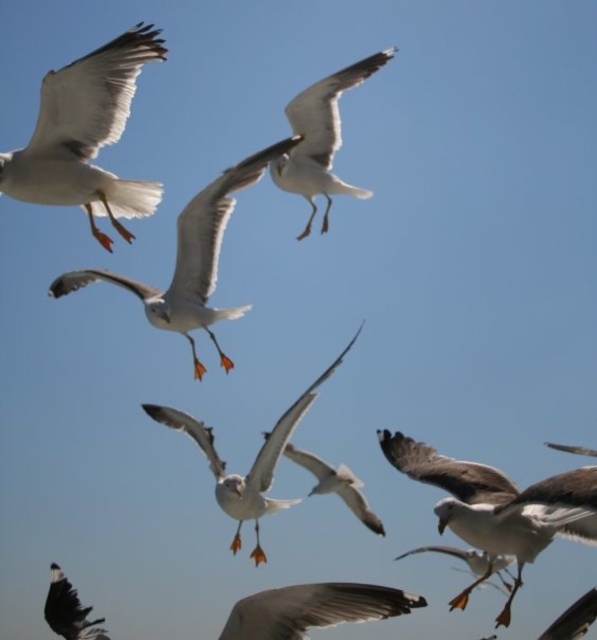
Question: Does white matte seagull at upper left have a smaller size compared to white feathered seagull at lower center?

Choices:
 (A) no
 (B) yes

Answer: (B)

Question: Does white feathered seagull at lower right have a larger size compared to white matte seagull at center?

Choices:
 (A) yes
 (B) no

Answer: (B)

Question: Which point is closer to the camera?

Choices:
 (A) (227, 632)
 (B) (214, 276)
 (C) (72, 632)
 (D) (318, 93)

Answer: (A)

Question: Which point is farther from the camera taking this photo?

Choices:
 (A) (293, 188)
 (B) (402, 468)

Answer: (A)

Question: Does white matte seagull at upper left have a larger size compared to white matte seagull at lower left?

Choices:
 (A) yes
 (B) no

Answer: (A)

Question: Which of the following is the closest to the observer?

Choices:
 (A) (66, 616)
 (B) (315, 140)
 (C) (493, 541)
 (D) (59, 625)

Answer: (C)